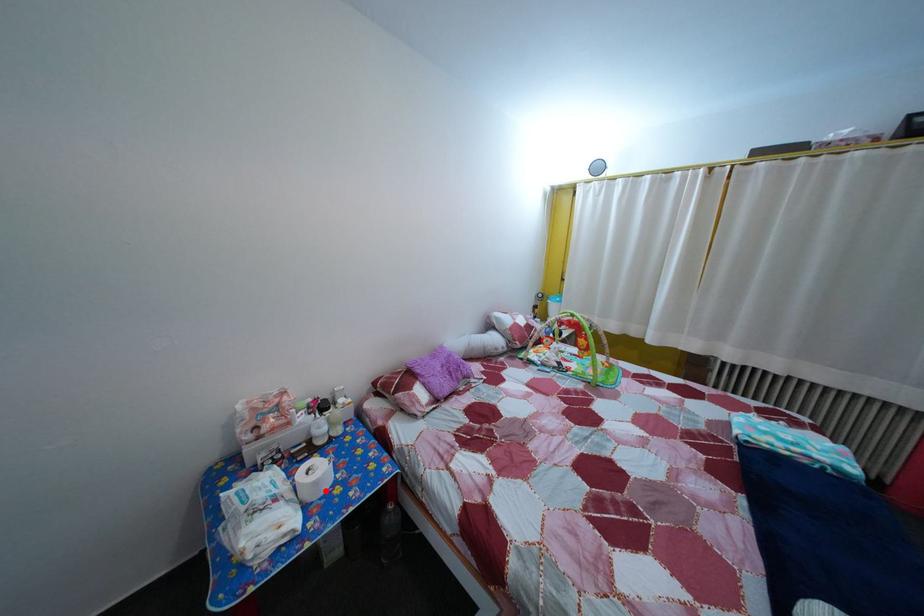
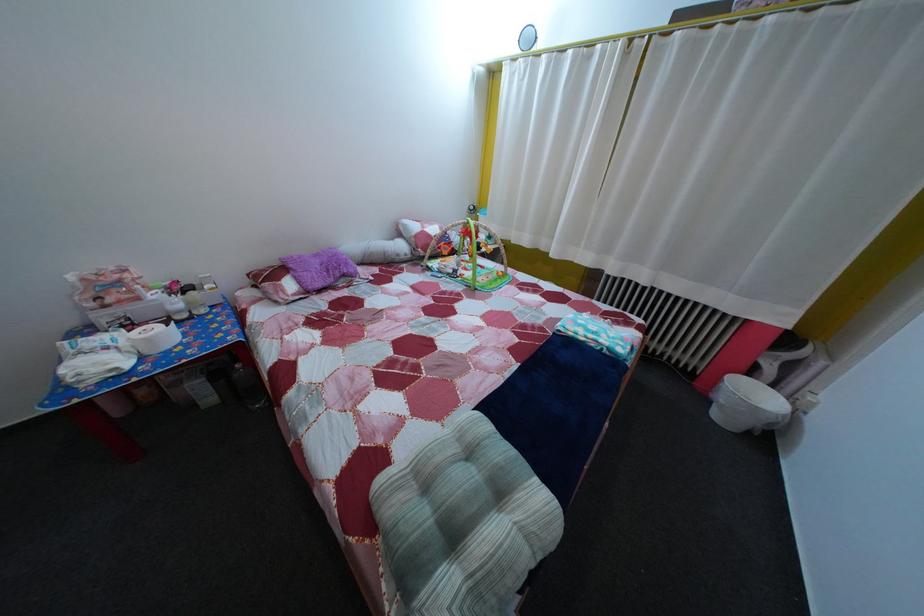
Locate, in the second image, the point that corresponds to the highlighted location in the first image.

(157, 347)